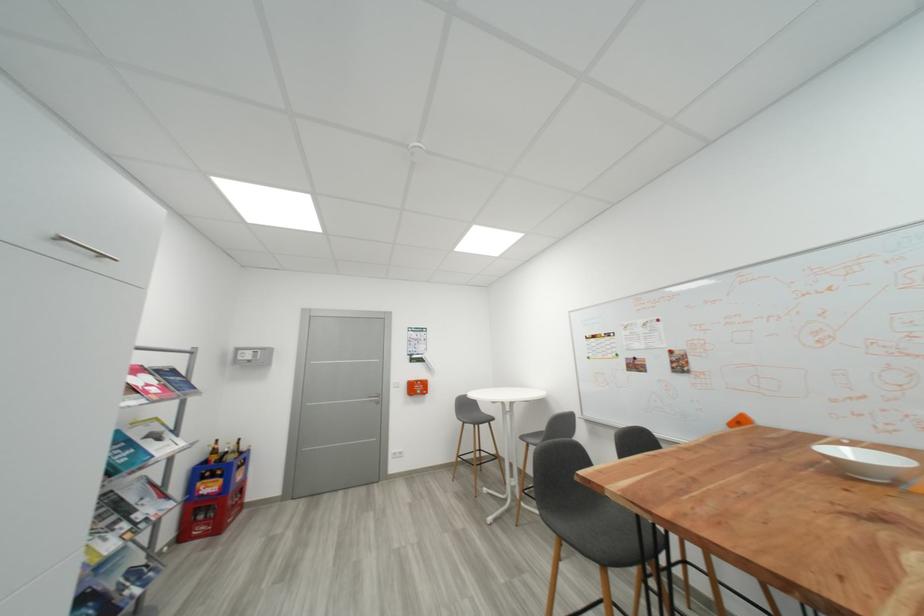
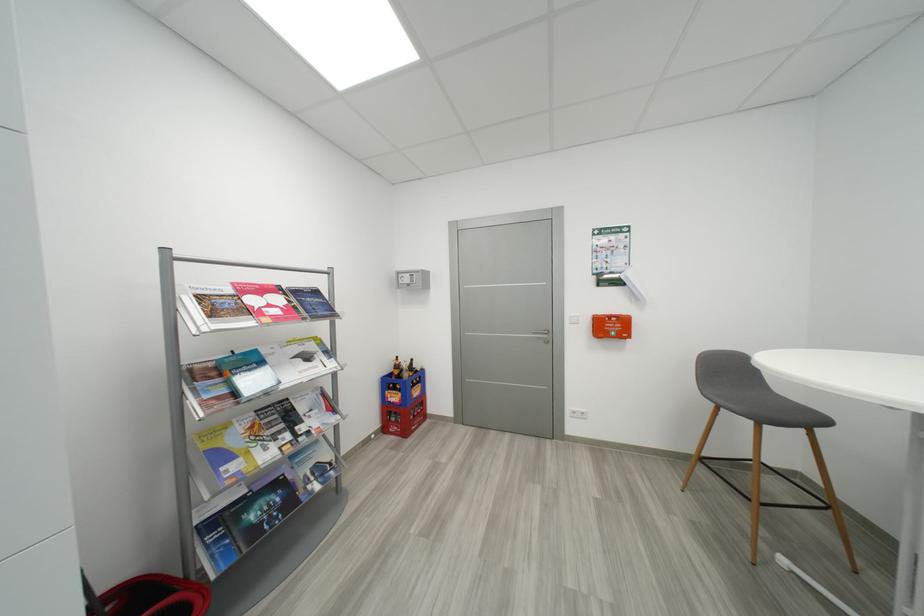
Locate, in the second image, the point that corresponds to (189,538) in the first image.

(392, 431)